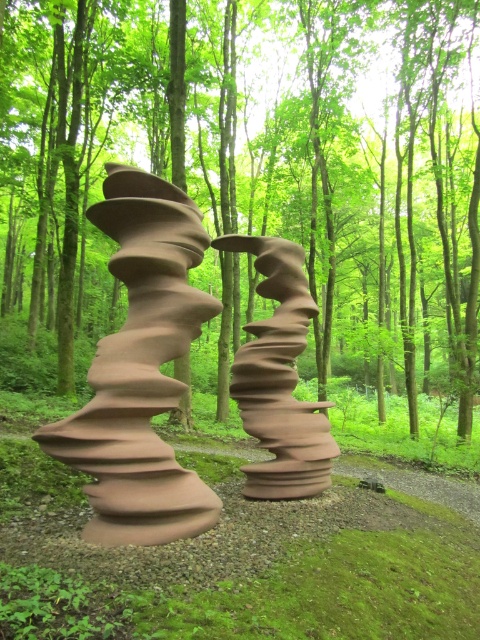
Which of these two, brown matte sculpture at center or matte brown sculpture at center, stands taller?

brown matte sculpture at center is taller.

Is brown matte sculpture at center taller than matte brown sculpture at center?

Indeed, brown matte sculpture at center has a greater height compared to matte brown sculpture at center.

Describe the element at coordinates (266, 154) in the screenshot. The height and width of the screenshot is (640, 480). I see `brown matte sculpture at center` at that location.

At what (x,y) coordinates should I click in order to perform the action: click on brown matte sculpture at center. Please return your answer as a coordinate pair (x, y). This screenshot has height=640, width=480. Looking at the image, I should click on (266, 154).

Can you confirm if brown matte sculpture at center is positioned below matte clay sculpture at center?

Actually, brown matte sculpture at center is above matte clay sculpture at center.

Does brown matte sculpture at center appear over matte clay sculpture at center?

Yes.

This screenshot has height=640, width=480. Describe the element at coordinates (266, 154) in the screenshot. I see `brown matte sculpture at center` at that location.

Locate an element on the screen. brown matte sculpture at center is located at coordinates (266, 154).

Who is shorter, matte brown sculpture at center or matte clay sculpture at center?

With less height is matte clay sculpture at center.

How distant is matte brown sculpture at center from matte clay sculpture at center?

matte brown sculpture at center and matte clay sculpture at center are 5.17 feet apart.

Which is in front, point (127, 440) or point (330, 433)?

Point (127, 440) is in front.

At what (x,y) coordinates should I click in order to perform the action: click on matte brown sculpture at center. Please return your answer as a coordinate pair (x, y). Looking at the image, I should click on (141, 371).